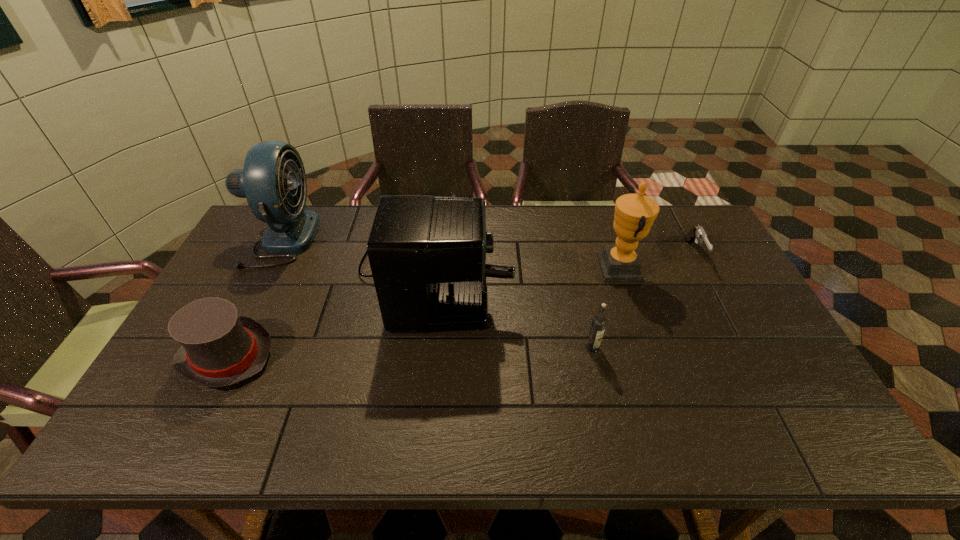
Where is `fan`? The width and height of the screenshot is (960, 540). fan is located at coordinates (271, 167).

Identify the location of award. The width and height of the screenshot is (960, 540). (634, 215).

Where is `coffee maker`? This screenshot has height=540, width=960. coffee maker is located at coordinates (427, 254).

The image size is (960, 540). What are the coordinates of `vodka` in the screenshot? It's located at (598, 324).

At what (x,y) coordinates should I click in order to perform the action: click on the fourth object from left to right. Please return your answer as a coordinate pair (x, y). This screenshot has width=960, height=540. Looking at the image, I should click on 598,324.

Identify the location of dress hat. This screenshot has height=540, width=960. (220, 348).

Identify the location of the shortest object. (697, 233).

Find the location of a particular element. The image size is (960, 540). the rightmost object is located at coordinates (697, 233).

In order to click on free point located 0.280m in front of the fan to blow air in this screenshot , I will do `click(397, 238)`.

Locate an element on the screen. free space located at the front of the fifth object from left to right with handles is located at coordinates (498, 268).